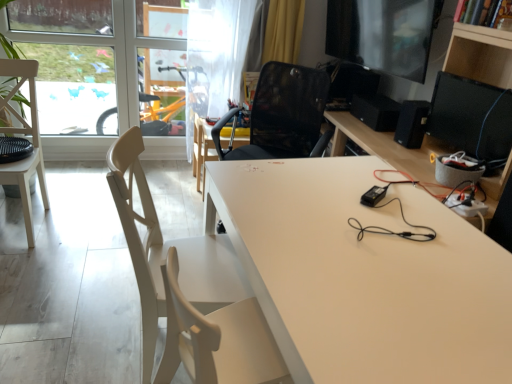
Question: Is the depth of white wood chair at left, the second chair in the left-to-right sequence, greater than that of white matte table at center, which is the second table from left to right?

Choices:
 (A) yes
 (B) no

Answer: (A)

Question: Can you see white wood chair at left, the second chair in the left-to-right sequence, touching white matte table at center, the 1th table viewed from the right?

Choices:
 (A) yes
 (B) no

Answer: (B)

Question: Can you confirm if white wood chair at left, acting as the second chair starting from the back, is positioned to the left of white matte table at center, the 2th table from the back?

Choices:
 (A) no
 (B) yes

Answer: (B)

Question: Is white matte table at center, the second table when ordered from top to bottom, at the back of white wood chair at left, the second chair in the left-to-right sequence?

Choices:
 (A) yes
 (B) no

Answer: (B)

Question: Is white wood chair at left, acting as the second chair starting from the back, positioned beyond the bounds of white matte table at center, the 1th table viewed from the right?

Choices:
 (A) yes
 (B) no

Answer: (B)

Question: Relative to black matte speaker at right, positioned as the 1th speaker in front-to-back order, is white wood chair at left, the 2th chair from the right, in front or behind?

Choices:
 (A) front
 (B) behind

Answer: (A)

Question: From the image's perspective, is white wood chair at left, the first chair positioned from the left, located above or below black matte speaker at right, positioned as the 1th speaker in front-to-back order?

Choices:
 (A) below
 (B) above

Answer: (A)

Question: Is white wood chair at left, the first chair in the back-to-front sequence, wider or thinner than black matte speaker at right, positioned as the 1th speaker in front-to-back order?

Choices:
 (A) thin
 (B) wide

Answer: (B)

Question: Considering the positions of white wood chair at left, the first chair positioned from the left, and black matte speaker at right, positioned as the 1th speaker in front-to-back order, in the image, is white wood chair at left, the first chair positioned from the left, bigger or smaller than black matte speaker at right, positioned as the 1th speaker in front-to-back order,?

Choices:
 (A) big
 (B) small

Answer: (A)

Question: Is white matte table at center, the first table positioned from the front, in front of or behind transparent glass window at upper left in the image?

Choices:
 (A) front
 (B) behind

Answer: (A)

Question: Looking at their shapes, would you say white matte table at center, which is the second table from left to right, is wider or thinner than transparent glass window at upper left?

Choices:
 (A) wide
 (B) thin

Answer: (A)

Question: In terms of size, does white matte table at center, which is the 1th table in bottom-to-top order, appear bigger or smaller than transparent glass window at upper left?

Choices:
 (A) big
 (B) small

Answer: (A)

Question: Does point (388, 309) appear closer or farther from the camera than point (49, 76)?

Choices:
 (A) farther
 (B) closer

Answer: (B)

Question: Looking at the image, does white wood chair at left, the 2th chair from the right, seem bigger or smaller compared to black glossy monitor at upper right, the 2th computer monitor from the top?

Choices:
 (A) big
 (B) small

Answer: (A)

Question: From a real-world perspective, relative to black glossy monitor at upper right, the first computer monitor when ordered from bottom to top, is white wood chair at left, positioned as the 2th chair in front-to-back order, vertically above or below?

Choices:
 (A) above
 (B) below

Answer: (B)